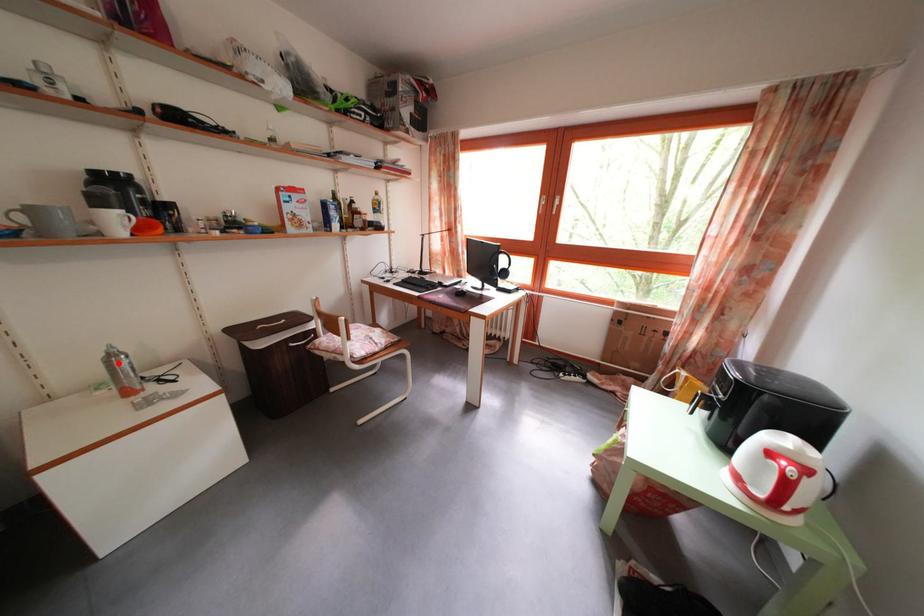
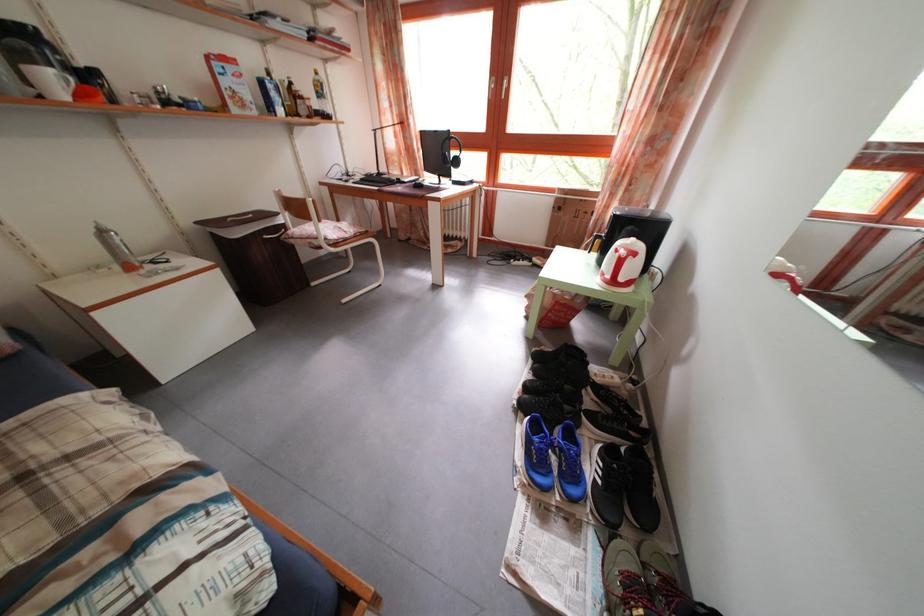
Where in the second image is the point corresponding to the highlighted location from the first image?

(108, 238)